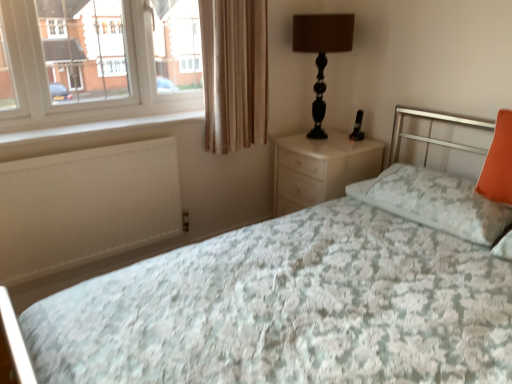
Describe the element at coordinates (320, 168) in the screenshot. I see `white glossy nightstand at center` at that location.

In order to face black glossy table lamp at upper right, should I rotate leftwards or rightwards?

It's best to rotate right around 8.778 degrees.

Where is `orange fabric pillow at right, which is the 1th pillow in left-to-right order`? The image size is (512, 384). orange fabric pillow at right, which is the 1th pillow in left-to-right order is located at coordinates (435, 201).

Describe the element at coordinates (86, 206) in the screenshot. I see `white matte radiator at lower left` at that location.

This screenshot has height=384, width=512. What do you see at coordinates (498, 163) in the screenshot? I see `orange fabric pillow at right, which ranks as the 1th pillow in right-to-left order` at bounding box center [498, 163].

Find the location of a particular element. This screenshot has height=384, width=512. floral fabric bed at center is located at coordinates (84, 207).

Between white matte radiator at lower left and floral fabric bed at center, which one has larger size?

floral fabric bed at center.

Is white matte radiator at lower left not close to floral fabric bed at center?

They are positioned close to each other.

Find the location of a particular element. bed below the white matte radiator at lower left (from a real-world perspective) is located at coordinates (84, 207).

In the scene shown: Which object is more forward, white matte radiator at lower left or floral fabric bed at center?

floral fabric bed at center is more forward.

Considering the sizes of objects black glossy table lamp at upper right and white matte radiator at lower left in the image provided, who is bigger, black glossy table lamp at upper right or white matte radiator at lower left?

black glossy table lamp at upper right.

From the image's perspective, between black glossy table lamp at upper right and white matte radiator at lower left, who is located below?

white matte radiator at lower left.

From a real-world perspective, between black glossy table lamp at upper right and white matte radiator at lower left, who is vertically lower?

white matte radiator at lower left.

Can you confirm if orange fabric pillow at right, the 2th pillow when ordered from right to left, is positioned to the left of white matte radiator at lower left?

No.

Does point (449, 218) come behind point (95, 156)?

No, it is not.

Considering the sizes of orange fabric pillow at right, which is the 1th pillow in left-to-right order, and white matte radiator at lower left in the image, is orange fabric pillow at right, which is the 1th pillow in left-to-right order, taller or shorter than white matte radiator at lower left?

Considering their sizes, orange fabric pillow at right, which is the 1th pillow in left-to-right order, has less height than white matte radiator at lower left.

Is white matte radiator at lower left at the back of orange fabric pillow at right, which is the 1th pillow in left-to-right order?

No, orange fabric pillow at right, which is the 1th pillow in left-to-right order, is not facing away from white matte radiator at lower left.

Is white glossy nightstand at center thinner than black glossy table lamp at upper right?

No, white glossy nightstand at center is not thinner than black glossy table lamp at upper right.

From a real-world perspective, is white glossy nightstand at center positioned above or below black glossy table lamp at upper right?

In terms of real-world spatial position, white glossy nightstand at center is below black glossy table lamp at upper right.

Is white glossy nightstand at center surrounding black glossy table lamp at upper right?

That's incorrect, black glossy table lamp at upper right is not inside white glossy nightstand at center.

Does white glossy nightstand at center appear on the left side of black glossy table lamp at upper right?

Incorrect, white glossy nightstand at center is not on the left side of black glossy table lamp at upper right.

Is black glossy table lamp at upper right located outside white glossy nightstand at center?

black glossy table lamp at upper right is positioned outside white glossy nightstand at center.

Who is bigger, black glossy table lamp at upper right or white glossy nightstand at center?

Bigger between the two is white glossy nightstand at center.

Considering the positions of objects black glossy table lamp at upper right and white glossy nightstand at center in the image provided, who is in front, black glossy table lamp at upper right or white glossy nightstand at center?

black glossy table lamp at upper right is more forward.

From a real-world perspective, relative to white glossy nightstand at center, is black glossy table lamp at upper right vertically above or below?

black glossy table lamp at upper right is above white glossy nightstand at center.

Is white matte radiator at lower left far from white glossy nightstand at center?

No.

Is white matte radiator at lower left oriented away from white glossy nightstand at center?

That's not correct — white matte radiator at lower left is not looking away from white glossy nightstand at center.

Would you say white glossy nightstand at center is part of white matte radiator at lower left's contents?

Definitely not — white glossy nightstand at center is not inside white matte radiator at lower left.

Does point (47, 128) lie in front of point (360, 152)?

Yes, it is in front of point (360, 152).

Considering the relative sizes of orange fabric pillow at right, the 2th pillow when ordered from right to left, and white matte radiator at lower left in the image provided, is orange fabric pillow at right, the 2th pillow when ordered from right to left, thinner than white matte radiator at lower left?

In fact, orange fabric pillow at right, the 2th pillow when ordered from right to left, might be wider than white matte radiator at lower left.

Which of these two, orange fabric pillow at right, which is the 1th pillow in left-to-right order, or white matte radiator at lower left, stands taller?

orange fabric pillow at right, which is the 1th pillow in left-to-right order, is taller.

Is orange fabric pillow at right, which is the 1th pillow in left-to-right order, spatially inside white matte radiator at lower left, or outside of it?

orange fabric pillow at right, which is the 1th pillow in left-to-right order, cannot be found inside white matte radiator at lower left.

From the image's perspective, between orange fabric pillow at right, the 2th pillow when ordered from right to left, and white matte radiator at lower left, which one is located above?

white matte radiator at lower left appears higher in the image.

This screenshot has height=384, width=512. I want to click on window sill located above the floral fabric bed at center (from the image's perspective), so click(x=99, y=126).

Where is `radiator in front of the black glossy table lamp at upper right`? The height and width of the screenshot is (384, 512). radiator in front of the black glossy table lamp at upper right is located at coordinates (86, 206).

Estimate the real-world distances between objects in this image. Which object is closer to orange fabric pillow at right, which ranks as the 1th pillow in right-to-left order, white matte radiator at lower left or beige fabric curtain at upper left?

Based on the image, beige fabric curtain at upper left appears to be nearer to orange fabric pillow at right, which ranks as the 1th pillow in right-to-left order.

When comparing their distances from white glossy nightstand at center, does orange fabric pillow at right, which is the 1th pillow in left-to-right order, or white matte radiator at lower left seem further?

The object further to white glossy nightstand at center is white matte radiator at lower left.

Estimate the real-world distances between objects in this image. Which object is further from white matte radiator at lower left, orange fabric pillow at right, which is counted as the second pillow, starting from the left, or white matte radiator at lower left?

orange fabric pillow at right, which is counted as the second pillow, starting from the left, is further to white matte radiator at lower left.

Which object lies nearer to the anchor point orange fabric pillow at right, which is counted as the second pillow, starting from the left, white matte radiator at lower left or beige fabric curtain at upper left?

Based on the image, beige fabric curtain at upper left appears to be nearer to orange fabric pillow at right, which is counted as the second pillow, starting from the left.

Considering their positions, is orange fabric pillow at right, which is the 1th pillow in left-to-right order, positioned further to white glossy nightstand at center than floral fabric bed at center?

floral fabric bed at center.

Looking at the image, which one is located further to white matte radiator at lower left, white matte radiator at lower left or white glossy nightstand at center?

white glossy nightstand at center.

Looking at the image, which one is located further to orange fabric pillow at right, which ranks as the 1th pillow in right-to-left order, orange fabric pillow at right, the 2th pillow when ordered from right to left, or floral fabric bed at center?

floral fabric bed at center lies further to orange fabric pillow at right, which ranks as the 1th pillow in right-to-left order, than the other object.

Considering their positions, is white glossy nightstand at center positioned further to beige fabric curtain at upper left than floral fabric bed at center?

Based on the image, white glossy nightstand at center appears to be further to beige fabric curtain at upper left.

You are a GUI agent. You are given a task and a screenshot of the screen. Output one action in this format:
    pyautogui.click(x=<x>, y=<y>)
    Task: Click on the nightstand situated between beige fabric curtain at upper left and orange fabric pillow at right, the 2th pillow when ordered from right to left, from left to right
    
    Given the screenshot: What is the action you would take?
    pyautogui.click(x=320, y=168)

Locate an element on the screen. nightstand between beige fabric curtain at upper left and orange fabric pillow at right, which ranks as the 1th pillow in right-to-left order, from left to right is located at coordinates (320, 168).

This screenshot has width=512, height=384. I want to click on bed between white matte radiator at lower left and orange fabric pillow at right, which is counted as the second pillow, starting from the left, from left to right, so click(84, 207).

Find the location of a particular element. Image resolution: width=512 pixels, height=384 pixels. window sill between floral fabric bed at center and white glossy nightstand at center along the z-axis is located at coordinates (99, 126).